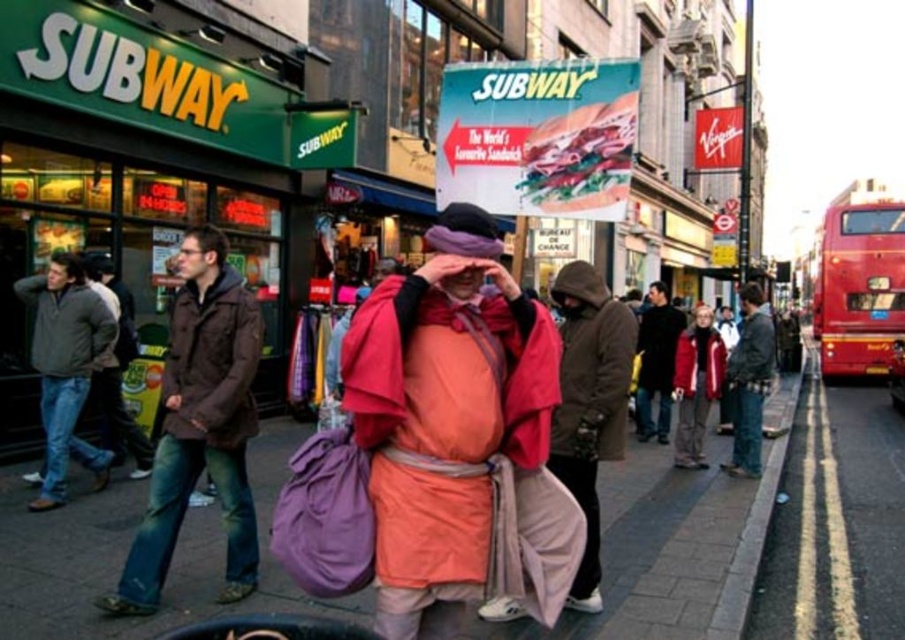
Does orange cotton robe at center have a greater width compared to pink fabric at center?

Indeed, orange cotton robe at center has a greater width compared to pink fabric at center.

Can you confirm if orange cotton robe at center is smaller than pink fabric at center?

Yes, orange cotton robe at center is smaller than pink fabric at center.

What do you see at coordinates (443, 429) in the screenshot? I see `orange cotton robe at center` at bounding box center [443, 429].

In order to click on orange cotton robe at center in this screenshot , I will do `click(443, 429)`.

Who is lower down, brown puffy jacket at left or pink fabric at center?

Positioned lower is pink fabric at center.

In the scene shown: Is brown puffy jacket at left positioned in front of pink fabric at center?

Yes, brown puffy jacket at left is closer to the viewer.

This screenshot has height=640, width=905. What do you see at coordinates (199, 426) in the screenshot?
I see `brown puffy jacket at left` at bounding box center [199, 426].

Identify the location of brown puffy jacket at left. This screenshot has height=640, width=905. (199, 426).

Between metallic red bus at right and dark brown leather jacket at center, which one appears on the left side from the viewer's perspective?

Positioned to the left is dark brown leather jacket at center.

The width and height of the screenshot is (905, 640). In order to click on metallic red bus at right in this screenshot , I will do `click(858, 280)`.